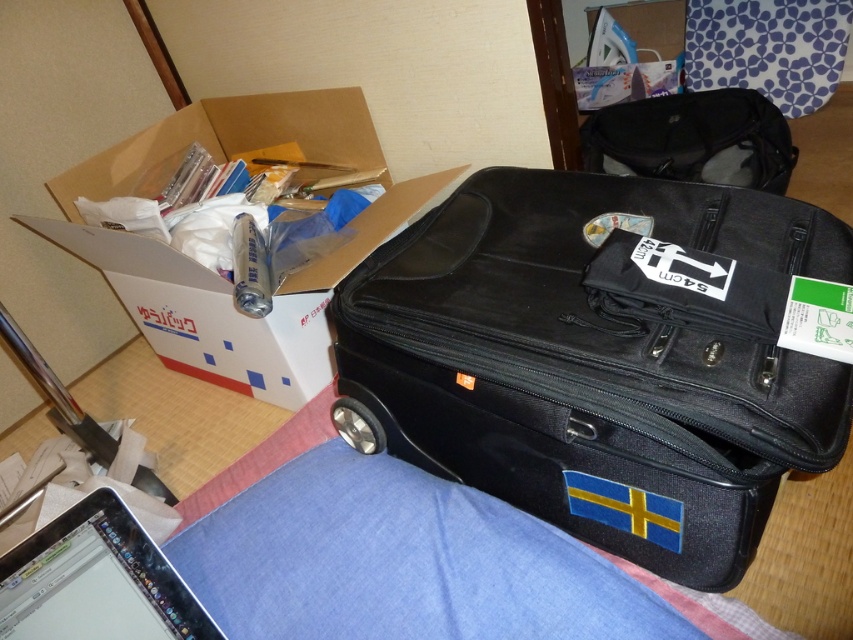
Between white cardboard box at upper left and matte black bag at upper right, which one is positioned higher?

Result: matte black bag at upper right

In order to click on white cardboard box at upper left in this screenshot , I will do `click(212, 269)`.

Is white cardboard box at upper left positioned at the back of sleek silver laptop at lower left?

Yes, it is behind sleek silver laptop at lower left.

Between white cardboard box at upper left and sleek silver laptop at lower left, which one appears on the right side from the viewer's perspective?

Positioned to the right is sleek silver laptop at lower left.

Between point (236, 136) and point (131, 577), which one is positioned behind?

Point (236, 136)

The height and width of the screenshot is (640, 853). Identify the location of white cardboard box at upper left. (212, 269).

Is black fabric suitcase at center above sleek silver laptop at lower left?

Indeed, black fabric suitcase at center is positioned over sleek silver laptop at lower left.

Can you confirm if black fabric suitcase at center is wider than sleek silver laptop at lower left?

Yes.

The height and width of the screenshot is (640, 853). I want to click on black fabric suitcase at center, so click(593, 364).